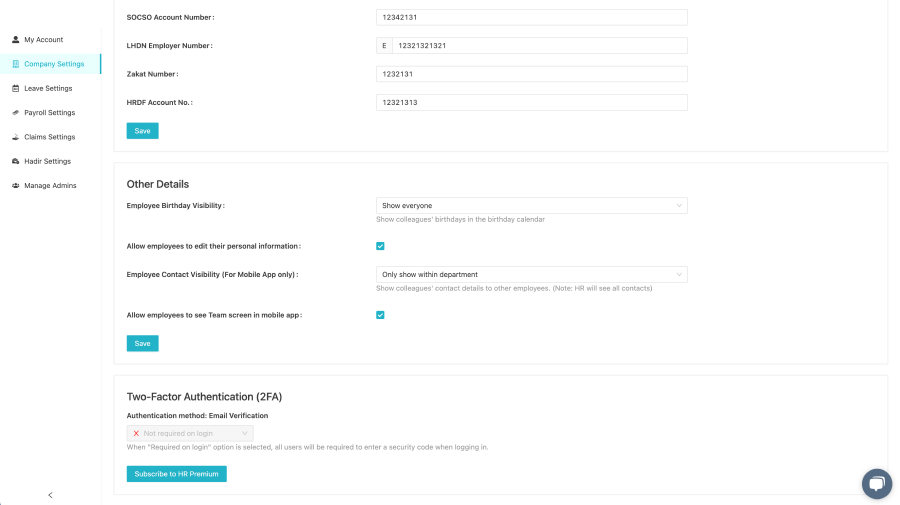
In order to click on phone in this screenshot , I will do `click(411, 41)`.